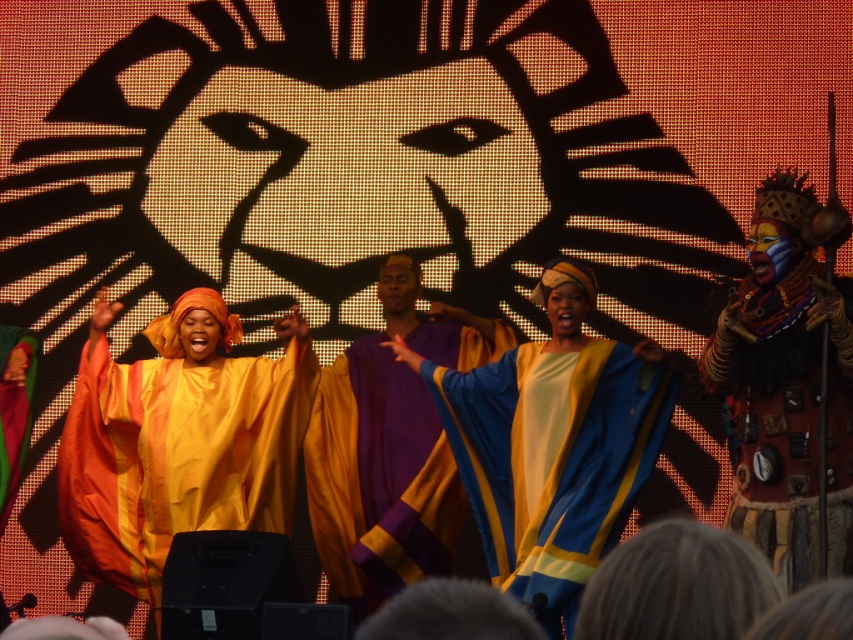
Which is behind, point (585, 524) or point (260, 436)?

The point (260, 436) is behind.

Between point (508, 534) and point (103, 460), which one is positioned behind?

The point (103, 460) is more distant.

Image resolution: width=853 pixels, height=640 pixels. What are the coordinates of `silky yellow robe at center` in the screenshot? It's located at (553, 444).

Can you confirm if purple satin robe at center is wider than leather-like brown mask at right?

Indeed, purple satin robe at center has a greater width compared to leather-like brown mask at right.

Can you confirm if purple satin robe at center is positioned above leather-like brown mask at right?

No.

Locate an element on the screen. purple satin robe at center is located at coordinates (379, 477).

Measure the distance between matte yellow robe at center and leather-like brown mask at right.

They are 23.57 meters apart.

Does matte yellow robe at center appear under leather-like brown mask at right?

Yes, matte yellow robe at center is below leather-like brown mask at right.

Is point (119, 384) farther from viewer compared to point (769, 472)?

Yes.

At what (x,y) coordinates should I click in order to perform the action: click on matte yellow robe at center. Please return your answer as a coordinate pair (x, y). Image resolution: width=853 pixels, height=640 pixels. Looking at the image, I should click on (177, 456).